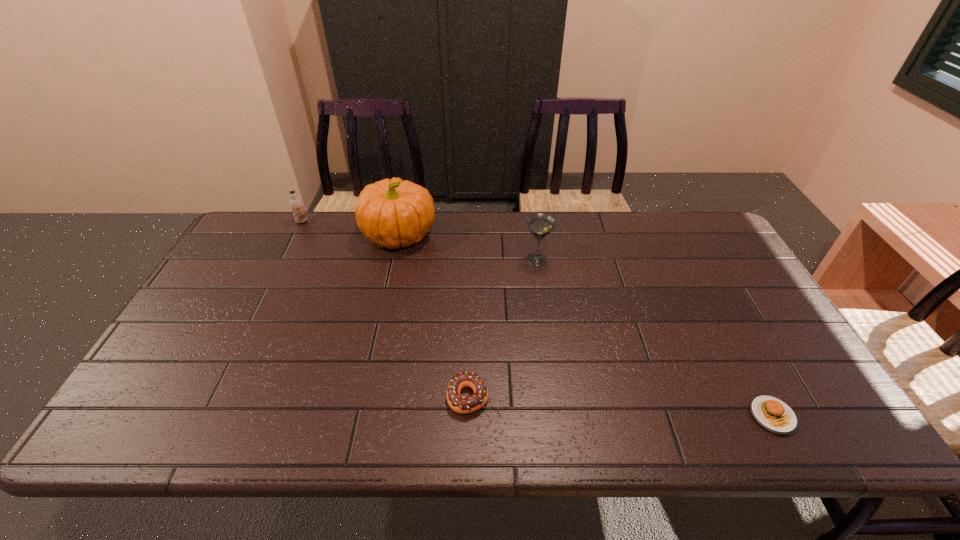
In order to click on empty location between the chocolate milk and the pumpkin in this screenshot , I will do `click(351, 228)`.

Where is `empty location between the pumpkin and the leftmost object`? The width and height of the screenshot is (960, 540). empty location between the pumpkin and the leftmost object is located at coordinates (351, 228).

Find the location of a particular element. Image resolution: width=960 pixels, height=540 pixels. vacant area between the second tallest object and the fourth tallest object is located at coordinates coord(502,328).

Identify the location of empty space that is in between the third object from left to right and the second object from right to left. (502, 328).

Identify the location of vacant area that lies between the chocolate milk and the doughnut. The height and width of the screenshot is (540, 960). (385, 309).

Image resolution: width=960 pixels, height=540 pixels. I want to click on free spot between the doughnut and the pumpkin, so click(434, 316).

Where is `empty space between the third object from right to left and the martini`? empty space between the third object from right to left and the martini is located at coordinates (502, 328).

Locate an element on the screen. This screenshot has height=540, width=960. vacant space that's between the tallest object and the fourth object from left to right is located at coordinates (468, 247).

I want to click on the fourth closest object to the second object from left to right, so click(773, 414).

Identify which object is the third closest to the shortest object. Please provide its 2D coordinates. Your answer should be formatted as a tuple, i.e. [(x, y)], where the tuple contains the x and y coordinates of a point satisfying the conditions above.

[(391, 213)]